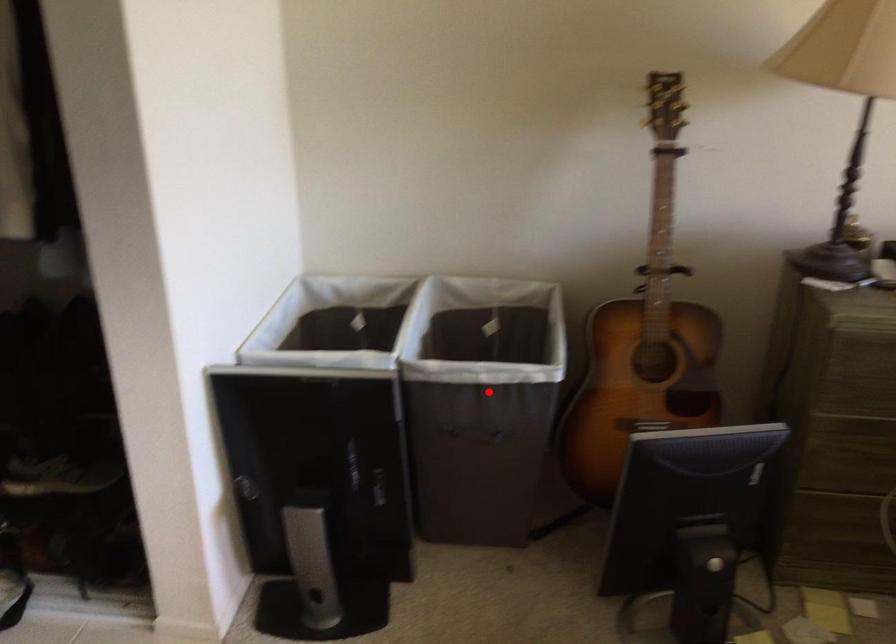
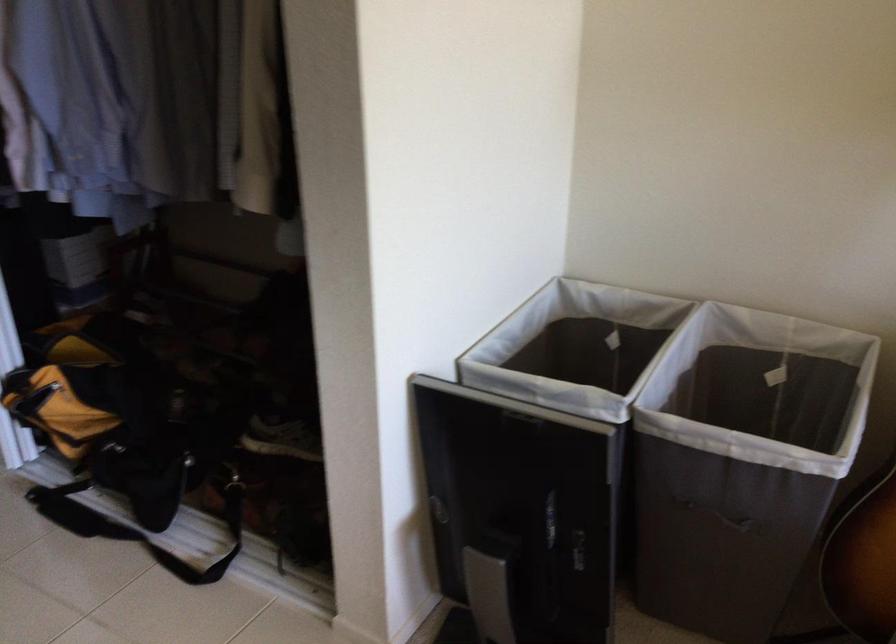
Question: I am providing you with two images of the same scene from different viewpoints. Image1 has a red point marked. In image2, the corresponding 3D location appears at what relative position? Reply with the corresponding letter.

Choices:
 (A) Closer
 (B) Farther

Answer: (A)